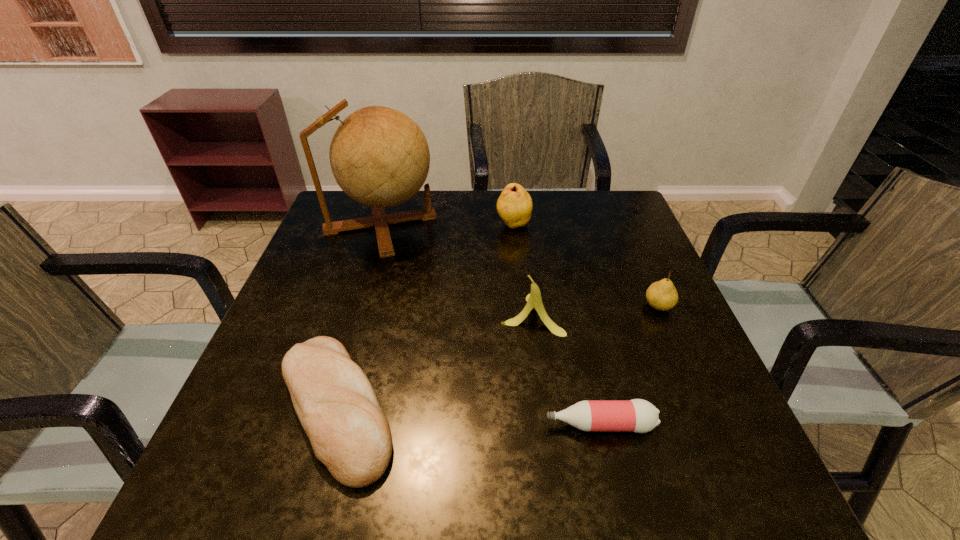
You are a GUI agent. You are given a task and a screenshot of the screen. Output one action in this format:
    pyautogui.click(x=<x>, y=<y>)
    Task: Click on the free spot located on the front of the banana
    This screenshot has height=540, width=960.
    Given the screenshot: What is the action you would take?
    pyautogui.click(x=542, y=400)

This screenshot has width=960, height=540. What are the coordinates of `vacant space situated 0.110m on the back of the rightmost object` in the screenshot? It's located at (641, 265).

Where is `free spot located 0.270m on the back of the bread`? This screenshot has height=540, width=960. free spot located 0.270m on the back of the bread is located at coordinates (376, 261).

What are the coordinates of `free space located with the cap open on the shortest object` in the screenshot? It's located at (481, 424).

This screenshot has width=960, height=540. Find the location of `free space located 0.250m with the cap open on the shortest object`. free space located 0.250m with the cap open on the shortest object is located at coordinates (400, 424).

The width and height of the screenshot is (960, 540). What are the coordinates of `free space located 0.260m with the cap open on the shortest object` in the screenshot? It's located at (395, 424).

Image resolution: width=960 pixels, height=540 pixels. Find the location of `globe present at the far edge`. globe present at the far edge is located at coordinates (379, 156).

Find the location of `pear located at the far edge`. pear located at the far edge is located at coordinates (514, 206).

Locate an element on the screen. Image resolution: width=960 pixels, height=540 pixels. object positioned at the near edge is located at coordinates (335, 402).

You are a GUI agent. You are given a task and a screenshot of the screen. Output one action in this format:
    pyautogui.click(x=<x>, y=<y>)
    Task: Click on the globe at the left edge
    The width and height of the screenshot is (960, 540).
    Given the screenshot: What is the action you would take?
    pyautogui.click(x=379, y=156)